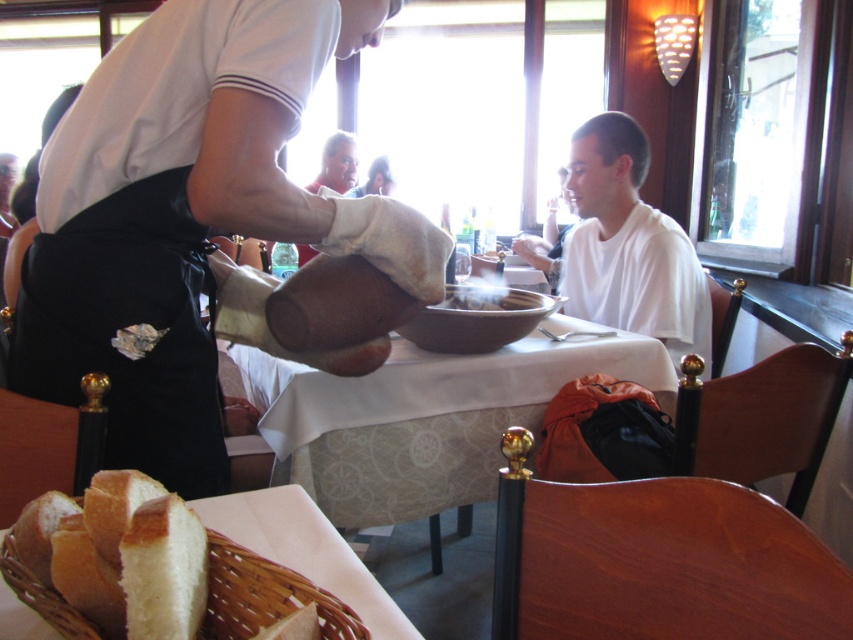
Question: Which point is farther from the camera taking this photo?

Choices:
 (A) (267, 144)
 (B) (691, 330)
 (C) (457, 392)
 (D) (404, 637)

Answer: (B)

Question: Does white matte shirt at upper center have a smaller size compared to white fabric table at center?

Choices:
 (A) yes
 (B) no

Answer: (A)

Question: Is white fabric table at center wider than white wicker basket at lower left?

Choices:
 (A) yes
 (B) no

Answer: (A)

Question: Which point is farther to the camera?

Choices:
 (A) white fabric table at center
 (B) white matte shirt at center

Answer: (B)

Question: Based on their relative distances, which object is nearer to the white matte shirt at center?

Choices:
 (A) white matte shirt at upper center
 (B) white wicker basket at lower left
 (C) white fabric table at center

Answer: (C)

Question: Does white matte shirt at center appear under white wicker basket at lower left?

Choices:
 (A) yes
 (B) no

Answer: (B)